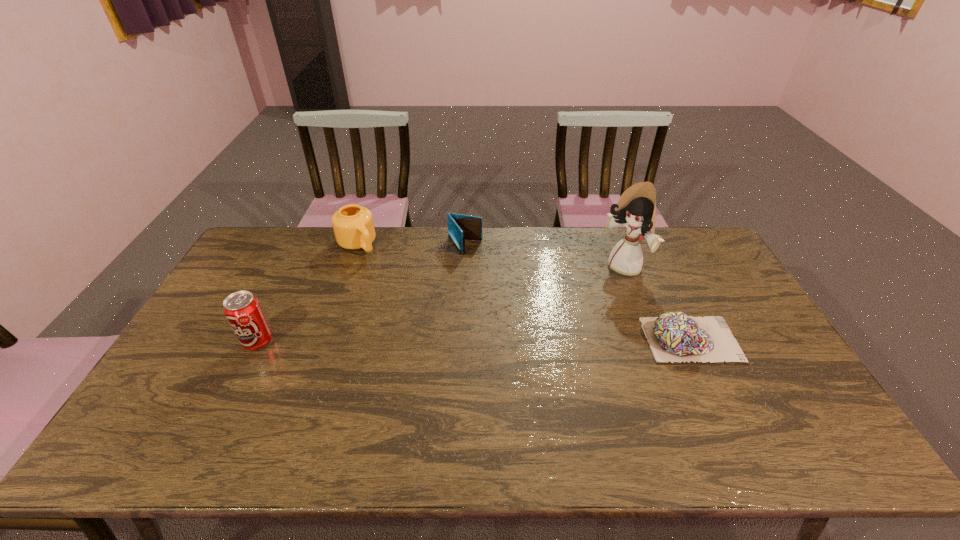
You are a GUI agent. You are given a task and a screenshot of the screen. Output one action in this format:
    pyautogui.click(x=<x>, y=<y>)
    Task: Click on the vacant spot on the desktop that is between the fourth shortest object and the shortest object and is positioned on the exterior surface of the second shortest object
    The width and height of the screenshot is (960, 540).
    Given the screenshot: What is the action you would take?
    pyautogui.click(x=539, y=340)

Identify the location of free spot on the desktop that is between the soda and the cap and is positioned at the front face of the tallest object. The width and height of the screenshot is (960, 540). click(525, 340).

Locate an element on the screen. Image resolution: width=960 pixels, height=540 pixels. vacant space on the desktop that is between the fourth shortest object and the cap and is positioned on the handle side of the third shortest object is located at coordinates (444, 341).